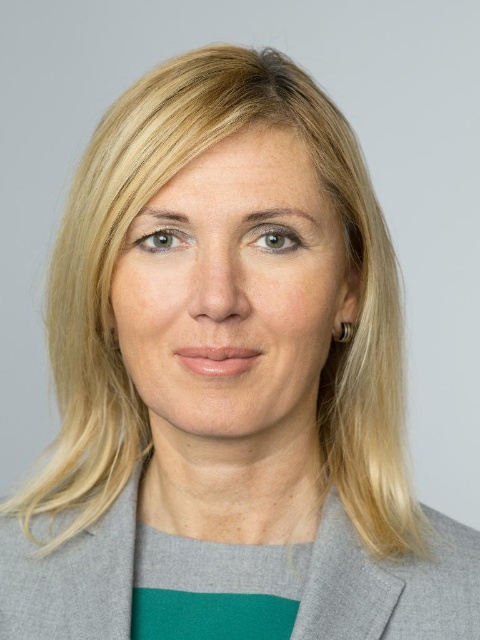
Is smooth skin face at center above gray woolen blazer at center?

Indeed, smooth skin face at center is positioned over gray woolen blazer at center.

Can you confirm if smooth skin face at center is smaller than gray woolen blazer at center?

Correct, smooth skin face at center occupies less space than gray woolen blazer at center.

Between point (146, 262) and point (437, 538), which one is positioned behind?

Point (437, 538)

Locate an element on the screen. The image size is (480, 640). smooth skin face at center is located at coordinates (233, 292).